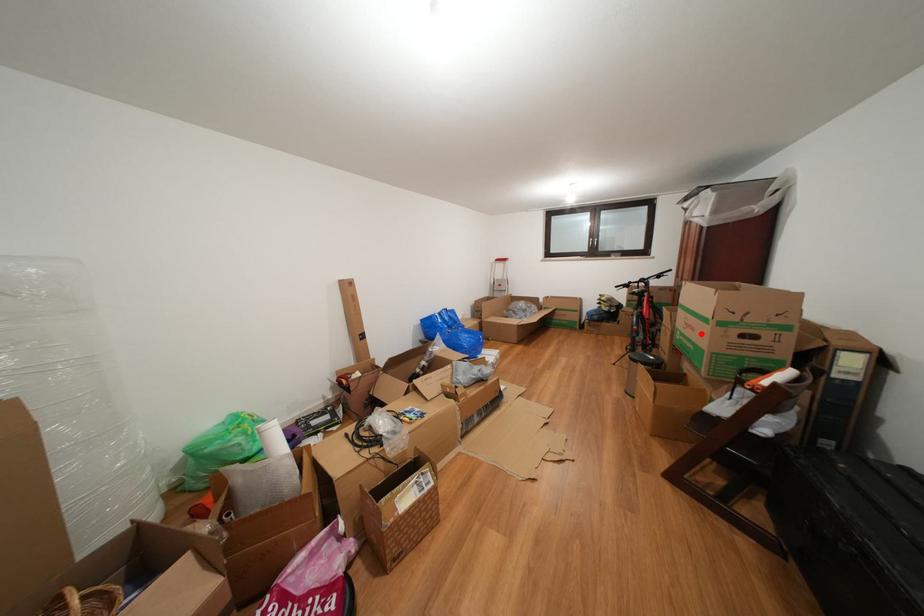
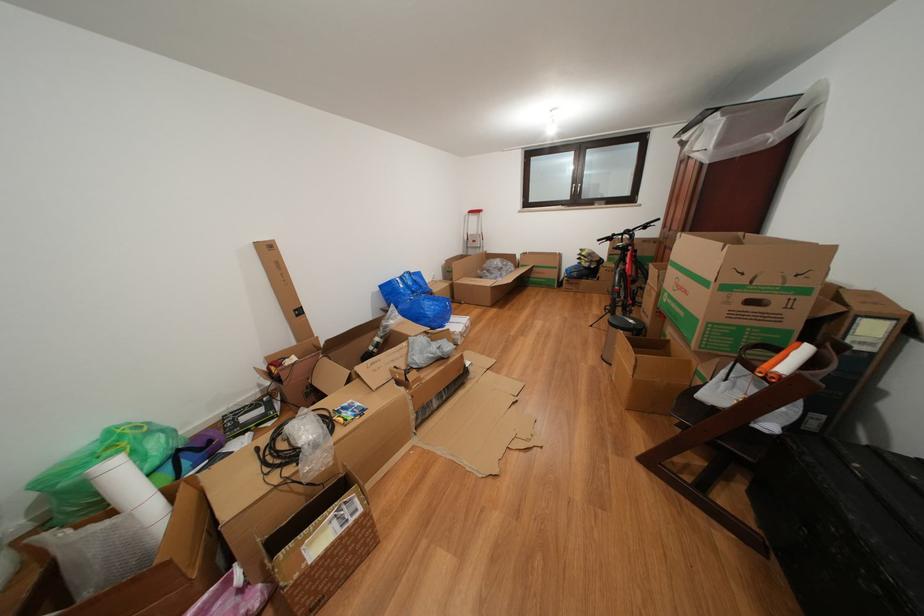
The point at the highlighted location is marked in the first image. Where is the corresponding point in the second image?

(694, 297)